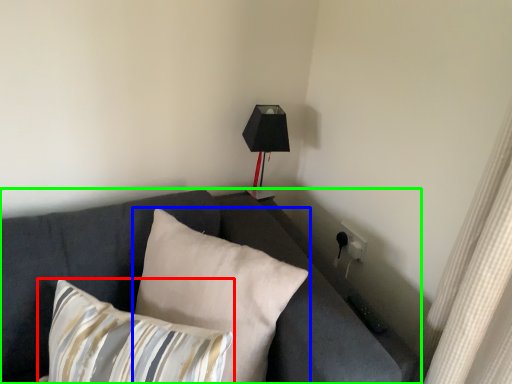
Question: Estimate the real-world distances between objects in this image. Which object is closer to pillow (highlighted by a red box), pillow (highlighted by a blue box) or studio couch (highlighted by a green box)?

Choices:
 (A) pillow
 (B) studio couch

Answer: (A)